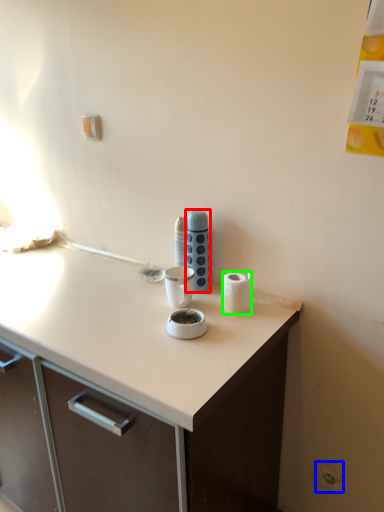
Question: Which is nearer to the appliance (highlighted by a red box)? electric outlet (highlighted by a blue box) or paper towel (highlighted by a green box).

Choices:
 (A) electric outlet
 (B) paper towel

Answer: (B)